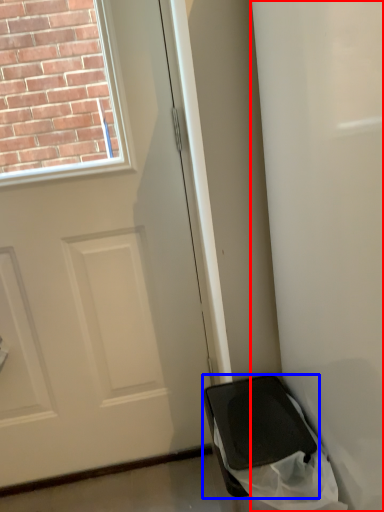
Question: Which object is closer to the camera taking this photo, screen door (highlighted by a red box) or furniture (highlighted by a blue box)?

Choices:
 (A) screen door
 (B) furniture

Answer: (A)